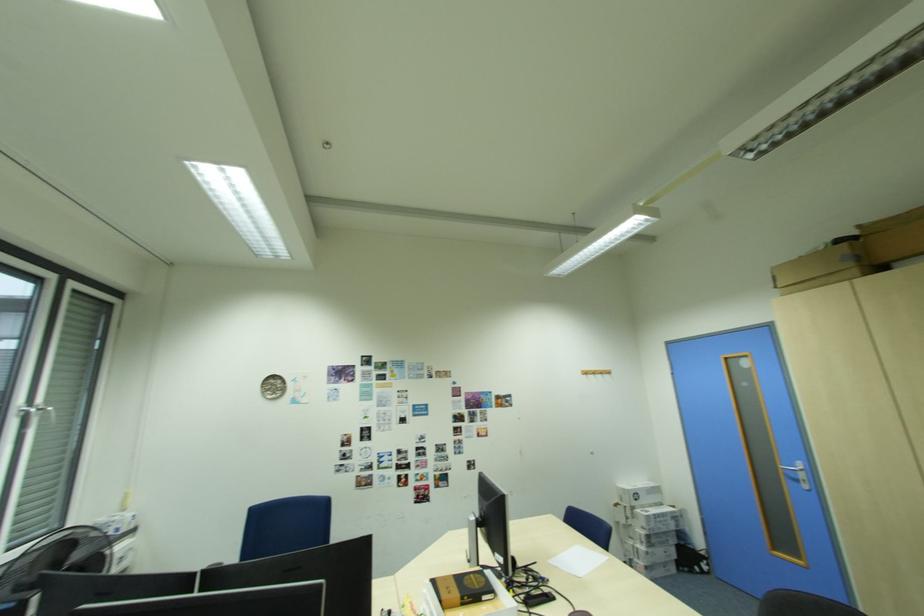
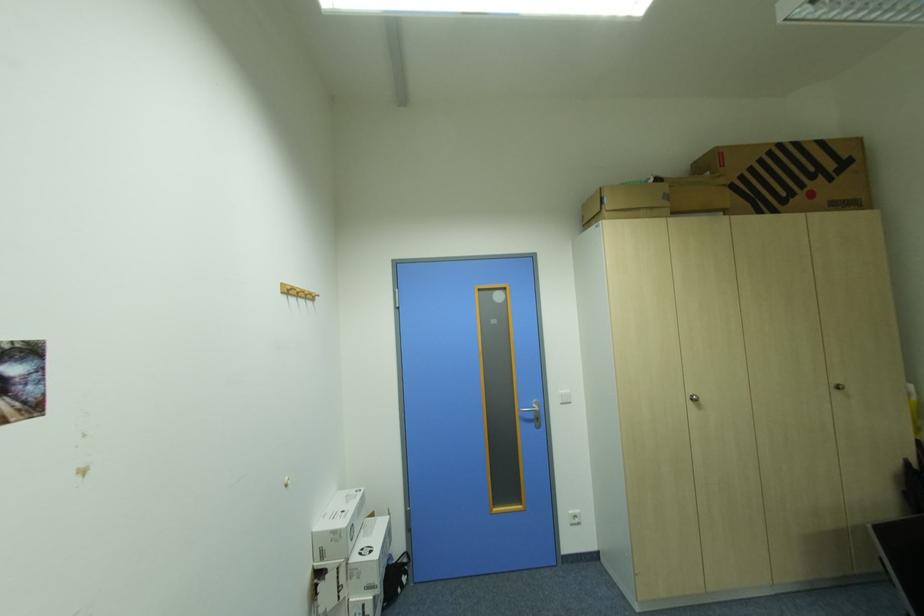
Locate, in the second image, the point that corresponds to (x=650, y=528) in the first image.

(377, 590)